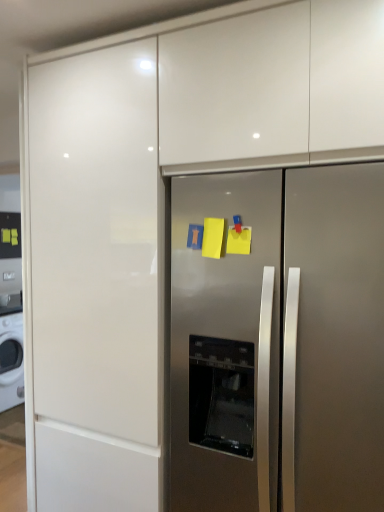
The height and width of the screenshot is (512, 384). What do you see at coordinates (278, 339) in the screenshot?
I see `stainless steel refrigerator at center` at bounding box center [278, 339].

Find the location of a particular element. stainless steel refrigerator at center is located at coordinates (278, 339).

Locate an element on the screen. The image size is (384, 512). stainless steel refrigerator at center is located at coordinates (278, 339).